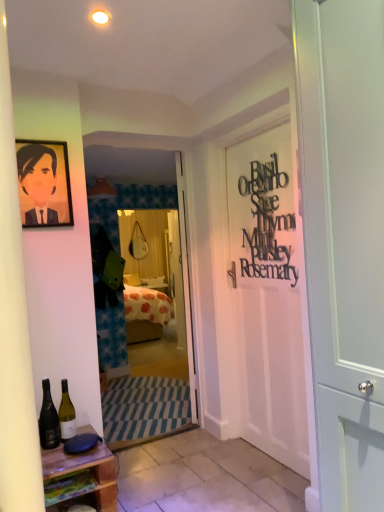
The height and width of the screenshot is (512, 384). I want to click on free point below black metallic sign at right (from a real-world perspective), so click(x=276, y=456).